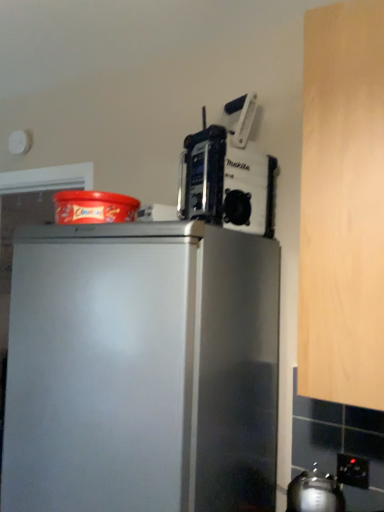
The image size is (384, 512). What do you see at coordinates (315, 492) in the screenshot?
I see `metallic silver kettle at lower right` at bounding box center [315, 492].

Identify the location of metallic silver kettle at lower right. Image resolution: width=384 pixels, height=512 pixels. (315, 492).

I want to click on metallic silver power tool at upper right, so click(x=228, y=176).

What is the approximate height of metallic silver power tool at upper right?

16.64 inches.

Where is `metallic silver kettle at lower right`? The image size is (384, 512). metallic silver kettle at lower right is located at coordinates (315, 492).

Is black plastic electric outlet at lower right oriented away from metallic silver power tool at upper right?

No, metallic silver power tool at upper right is not at the back of black plastic electric outlet at lower right.

From a real-world perspective, is black plastic electric outlet at lower right positioned under metallic silver power tool at upper right based on gravity?

Yes, from a real-world perspective, black plastic electric outlet at lower right is beneath metallic silver power tool at upper right.

Which of these two, black plastic electric outlet at lower right or metallic silver power tool at upper right, is smaller?

Smaller between the two is black plastic electric outlet at lower right.

How many degrees apart are the facing directions of black plastic electric outlet at lower right and metallic silver power tool at upper right?

The facing directions of black plastic electric outlet at lower right and metallic silver power tool at upper right are 22.4 degrees apart.

How different are the orientations of metallic silver kettle at lower right and metallic silver power tool at upper right in degrees?

There is a 37.4-degree angle between the facing directions of metallic silver kettle at lower right and metallic silver power tool at upper right.

Image resolution: width=384 pixels, height=512 pixels. In order to click on appliance in front of the metallic silver power tool at upper right in this screenshot , I will do `click(315, 492)`.

Which object is positioned more to the right, metallic silver kettle at lower right or metallic silver power tool at upper right?

From the viewer's perspective, metallic silver kettle at lower right appears more on the right side.

Is metallic silver power tool at upper right located within metallic silver kettle at lower right?

That's incorrect, metallic silver power tool at upper right is not inside metallic silver kettle at lower right.

Can you see metallic silver kettle at lower right touching black plastic electric outlet at lower right?

metallic silver kettle at lower right is not next to black plastic electric outlet at lower right, and they're not touching.

Is metallic silver kettle at lower right facing towards black plastic electric outlet at lower right?

No, metallic silver kettle at lower right is not aimed at black plastic electric outlet at lower right.

From the image's perspective, which object appears higher, metallic silver kettle at lower right or black plastic electric outlet at lower right?

black plastic electric outlet at lower right, from the image's perspective.

From the picture: Considering the sizes of metallic silver kettle at lower right and black plastic electric outlet at lower right in the image, is metallic silver kettle at lower right taller or shorter than black plastic electric outlet at lower right?

Clearly, metallic silver kettle at lower right is taller compared to black plastic electric outlet at lower right.

What's the angular difference between metallic silver power tool at upper right and metallic silver kettle at lower right's facing directions?

They differ by 37.4 degrees in their facing directions.

Can you confirm if metallic silver power tool at upper right is positioned to the right of metallic silver kettle at lower right?

Incorrect, metallic silver power tool at upper right is not on the right side of metallic silver kettle at lower right.

Could you measure the distance between metallic silver power tool at upper right and metallic silver kettle at lower right?

metallic silver power tool at upper right is 75.45 centimeters from metallic silver kettle at lower right.

Consider the image. Can you confirm if metallic silver power tool at upper right is bigger than metallic silver kettle at lower right?

Correct, metallic silver power tool at upper right is larger in size than metallic silver kettle at lower right.

Is metallic silver power tool at upper right facing away from black plastic electric outlet at lower right?

metallic silver power tool at upper right does not have its back to black plastic electric outlet at lower right.

Considering the positions of objects metallic silver power tool at upper right and black plastic electric outlet at lower right in the image provided, who is more to the left, metallic silver power tool at upper right or black plastic electric outlet at lower right?

metallic silver power tool at upper right is more to the left.

Which of these two, metallic silver power tool at upper right or black plastic electric outlet at lower right, is thinner?

black plastic electric outlet at lower right.

Can you tell me how much metallic silver power tool at upper right and black plastic electric outlet at lower right differ in facing direction?

The angle between the facing direction of metallic silver power tool at upper right and the facing direction of black plastic electric outlet at lower right is 22.4 degrees.

What's the angular difference between black plastic electric outlet at lower right and metallic silver kettle at lower right's facing directions?

The angle between the facing direction of black plastic electric outlet at lower right and the facing direction of metallic silver kettle at lower right is 15 degrees.

Where is `appliance below the black plastic electric outlet at lower right (from the image's perspective)`? The image size is (384, 512). appliance below the black plastic electric outlet at lower right (from the image's perspective) is located at coordinates (315, 492).

Is the depth of black plastic electric outlet at lower right greater than that of metallic silver kettle at lower right?

Yes.

Where is `electric outlet that appears below the metallic silver power tool at upper right (from a real-world perspective)`? The image size is (384, 512). electric outlet that appears below the metallic silver power tool at upper right (from a real-world perspective) is located at coordinates (353, 471).

Find the location of `kitchen appliance on the left of metallic silver kettle at lower right`. kitchen appliance on the left of metallic silver kettle at lower right is located at coordinates (228, 176).

Looking at the image, which one is located closer to metallic silver kettle at lower right, black plastic electric outlet at lower right or metallic silver power tool at upper right?

black plastic electric outlet at lower right.

Based on their spatial positions, is metallic silver power tool at upper right or metallic silver kettle at lower right further from black plastic electric outlet at lower right?

metallic silver power tool at upper right lies further to black plastic electric outlet at lower right than the other object.

When comparing their distances from metallic silver kettle at lower right, does metallic silver power tool at upper right or black plastic electric outlet at lower right seem closer?

Based on the image, black plastic electric outlet at lower right appears to be nearer to metallic silver kettle at lower right.

From the image, which object appears to be farther from metallic silver power tool at upper right, black plastic electric outlet at lower right or metallic silver kettle at lower right?

black plastic electric outlet at lower right is positioned further to the anchor metallic silver power tool at upper right.

Estimate the real-world distances between objects in this image. Which object is closer to metallic silver power tool at upper right, metallic silver kettle at lower right or black plastic electric outlet at lower right?

metallic silver kettle at lower right is closer to metallic silver power tool at upper right.

When comparing their distances from black plastic electric outlet at lower right, does metallic silver kettle at lower right or metallic silver power tool at upper right seem further?

metallic silver power tool at upper right is further to black plastic electric outlet at lower right.

Image resolution: width=384 pixels, height=512 pixels. I want to click on electric outlet between metallic silver power tool at upper right and metallic silver kettle at lower right in the up-down direction, so click(353, 471).